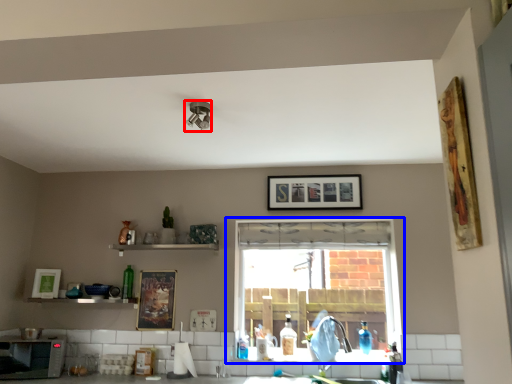
Question: Which of the following is the closest to the observer, light fixture (highlighted by a red box) or window (highlighted by a blue box)?

Choices:
 (A) light fixture
 (B) window

Answer: (A)